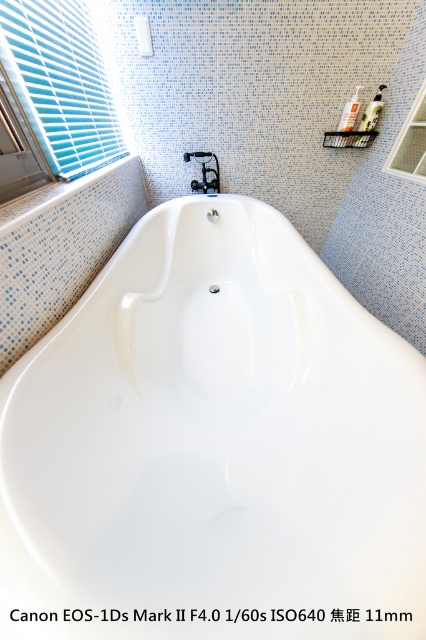
You are standing in the bathroom and want to open the clear glass window at upper right to let in more light. However, you need to reach it while avoiding touching the black plastic faucet at center. Can you do this without moving the faucet?

The clear glass window at upper right is below the black plastic faucet at center, so you can reach the window without touching the faucet by moving your hand underneath the faucet.

You are a window cleaner standing at the center of the bathroom. You need to clean the blue plastic blinds at upper left. Which direction should you move to reach them?

The blue plastic blinds at upper left are located at point (60, 83), so you should move towards the upper left direction to reach them.

You are a painter standing in the bathroom and want to paint the white glossy bathtub at center. To avoid getting paint on the blue plastic blinds at upper left, which direction should you be careful to avoid spraying paint towards?

The white glossy bathtub at center is below the blue plastic blinds at upper left, so you should be careful to avoid spraying paint upwards towards the blue plastic blinds at upper left.